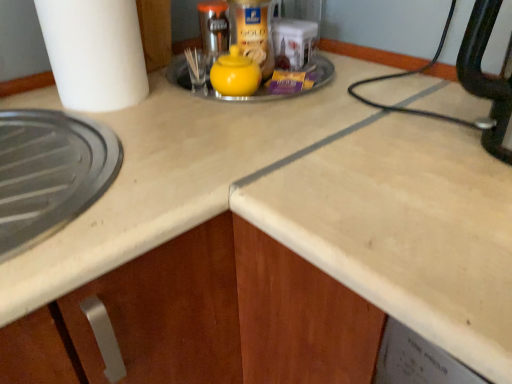
Locate an element on the screen. vacant space to the right of yellow matte teapot at center is located at coordinates (302, 87).